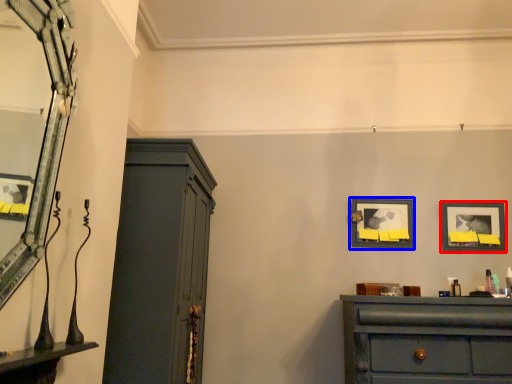
Question: Which object appears closest to the camera in this image, picture frame (highlighted by a red box) or picture frame (highlighted by a blue box)?

Choices:
 (A) picture frame
 (B) picture frame

Answer: (A)